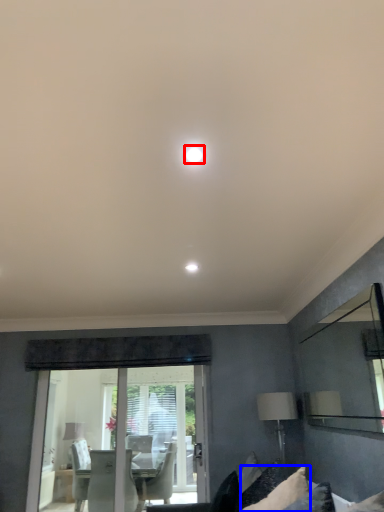
Question: Which object is further to the camera taking this photo, lighting (highlighted by a red box) or pillow (highlighted by a blue box)?

Choices:
 (A) lighting
 (B) pillow

Answer: (B)